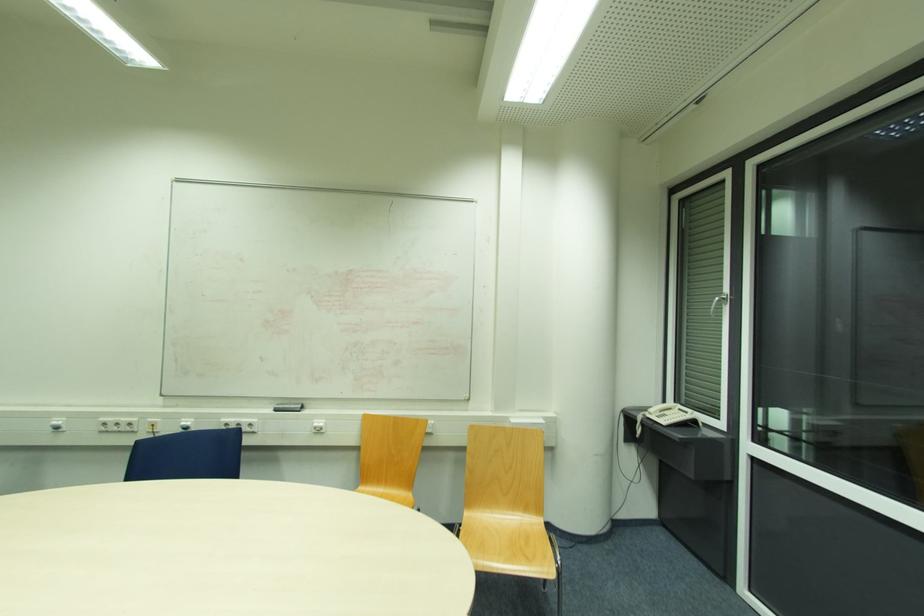
Where would you lift the telephone handset? Please return your answer as a coordinate pair (x, y).

(664, 407)